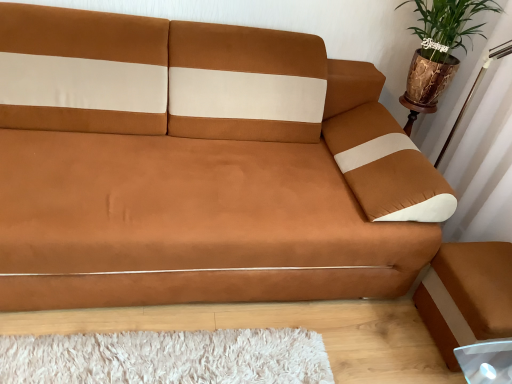
Question: Could you tell me if brown leather footrest at lower right is facing green leafy plant in brown pot at upper right?

Choices:
 (A) no
 (B) yes

Answer: (A)

Question: From a real-world perspective, is brown leather footrest at lower right physically above green leafy plant in brown pot at upper right?

Choices:
 (A) no
 (B) yes

Answer: (A)

Question: Does brown leather footrest at lower right contain green leafy plant in brown pot at upper right?

Choices:
 (A) yes
 (B) no

Answer: (B)

Question: Can you confirm if brown leather footrest at lower right is positioned to the right of green leafy plant in brown pot at upper right?

Choices:
 (A) yes
 (B) no

Answer: (A)

Question: Is brown leather footrest at lower right bigger than green leafy plant in brown pot at upper right?

Choices:
 (A) no
 (B) yes

Answer: (A)

Question: In terms of height, does suede brown couch at center look taller or shorter compared to brown leather footrest at lower right?

Choices:
 (A) tall
 (B) short

Answer: (A)

Question: Considering their positions, is suede brown couch at center located in front of or behind brown leather footrest at lower right?

Choices:
 (A) front
 (B) behind

Answer: (A)

Question: In terms of size, does suede brown couch at center appear bigger or smaller than brown leather footrest at lower right?

Choices:
 (A) small
 (B) big

Answer: (B)

Question: Based on their positions, is suede brown couch at center located to the left or right of brown leather footrest at lower right?

Choices:
 (A) left
 (B) right

Answer: (A)

Question: From their relative heights in the image, would you say green leafy plant in brown pot at upper right is taller or shorter than brown leather footrest at lower right?

Choices:
 (A) tall
 (B) short

Answer: (A)

Question: In the image, is green leafy plant in brown pot at upper right on the left side or the right side of brown leather footrest at lower right?

Choices:
 (A) left
 (B) right

Answer: (A)

Question: Looking at the image, does green leafy plant in brown pot at upper right seem bigger or smaller compared to brown leather footrest at lower right?

Choices:
 (A) small
 (B) big

Answer: (B)

Question: Considering the positions of green leafy plant in brown pot at upper right and brown leather footrest at lower right in the image, is green leafy plant in brown pot at upper right wider or thinner than brown leather footrest at lower right?

Choices:
 (A) thin
 (B) wide

Answer: (B)

Question: From a real-world perspective, relative to green leafy plant in brown pot at upper right, is suede brown couch at center vertically above or below?

Choices:
 (A) above
 (B) below

Answer: (B)

Question: Considering the positions of suede brown couch at center and green leafy plant in brown pot at upper right in the image, is suede brown couch at center bigger or smaller than green leafy plant in brown pot at upper right?

Choices:
 (A) big
 (B) small

Answer: (A)